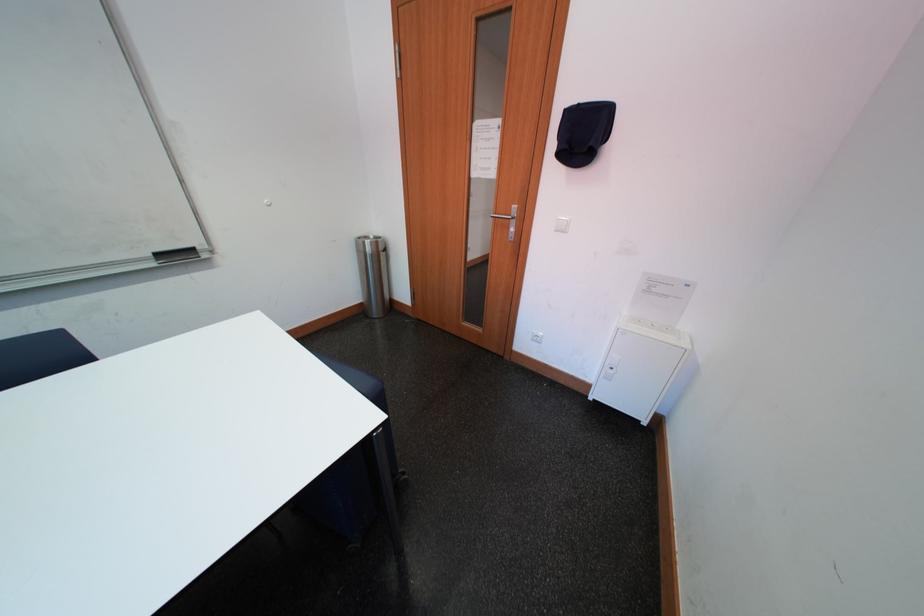
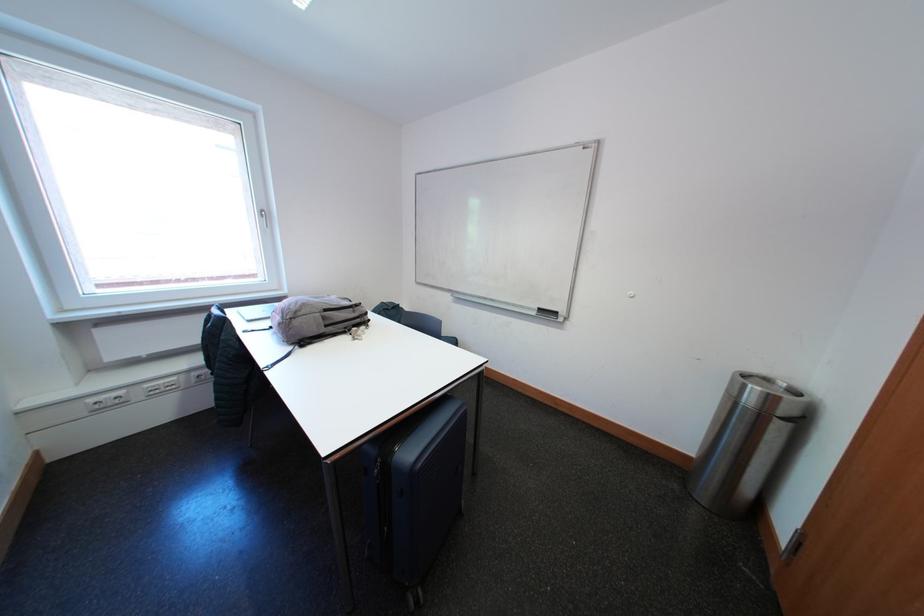
Question: The camera is either moving clockwise (left) or counter-clockwise (right) around the object. The first image is from the beginning of the video and the second image is from the end. Is the camera moving left or right when shooting the video?

Choices:
 (A) Left
 (B) Right

Answer: (B)